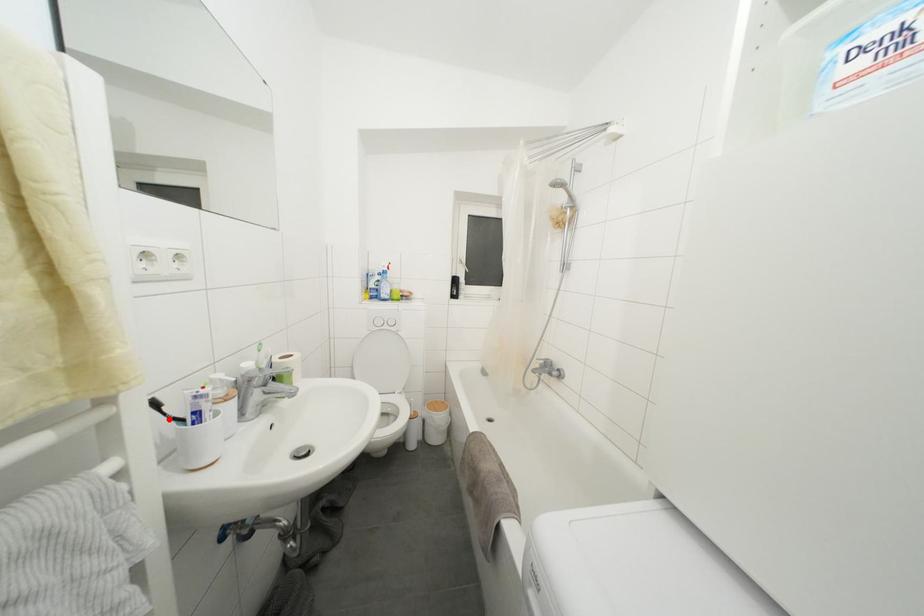
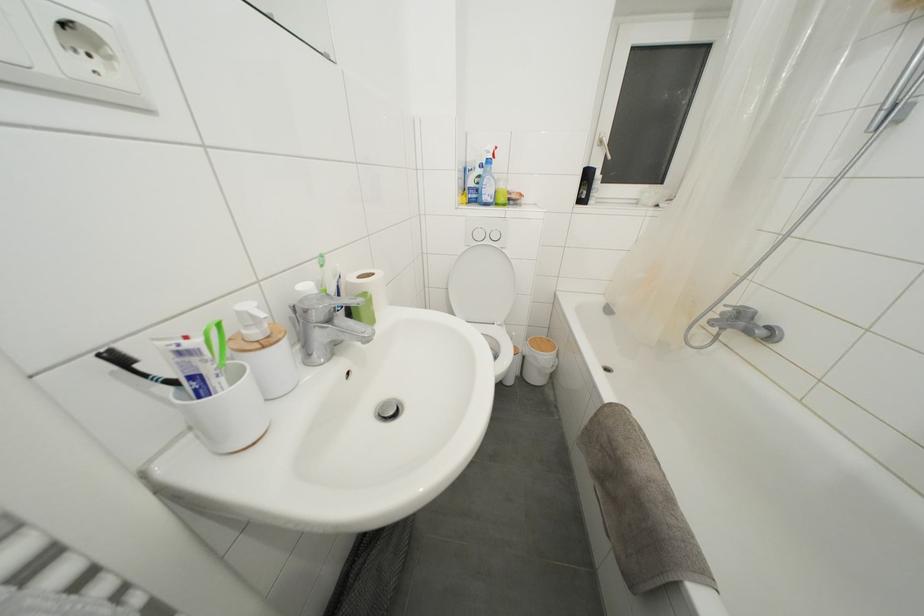
Find the pixel in the second image that matches the highlighted location in the first image.

(150, 381)